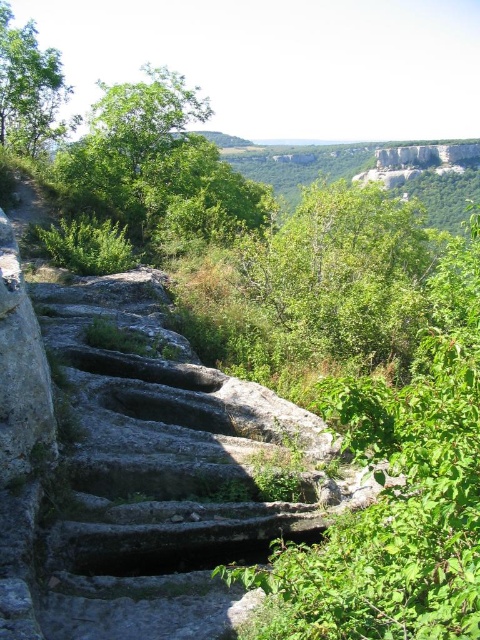
Who is lower down, green leafy tree at upper center or green leafy tree at upper left?

green leafy tree at upper center

Between green leafy tree at upper center and green leafy tree at upper left, which one is positioned higher?

green leafy tree at upper left

Image resolution: width=480 pixels, height=640 pixels. In order to click on green leafy tree at upper center in this screenshot , I will do click(156, 166).

At what (x,y) coordinates should I click in order to perform the action: click on green leafy tree at upper center. Please return your answer as a coordinate pair (x, y). The height and width of the screenshot is (640, 480). Looking at the image, I should click on (156, 166).

Measure the distance between green leafy tree at center and green leafy tree at upper center.

The distance of green leafy tree at center from green leafy tree at upper center is 6.19 meters.

Which is more to the right, green leafy tree at center or green leafy tree at upper center?

green leafy tree at center

Where is `green leafy tree at center`? The height and width of the screenshot is (640, 480). green leafy tree at center is located at coordinates (342, 275).

Where is `green leafy tree at center`? The width and height of the screenshot is (480, 640). green leafy tree at center is located at coordinates (342, 275).

Can you confirm if green leafy tree at center is smaller than green leafy tree at upper left?

Actually, green leafy tree at center might be larger than green leafy tree at upper left.

Is point (372, 202) positioned before point (26, 32)?

That is True.

You are a GUI agent. You are given a task and a screenshot of the screen. Output one action in this format:
    pyautogui.click(x=<x>, y=<y>)
    Task: Click on the green leafy tree at center
    
    Given the screenshot: What is the action you would take?
    pyautogui.click(x=342, y=275)